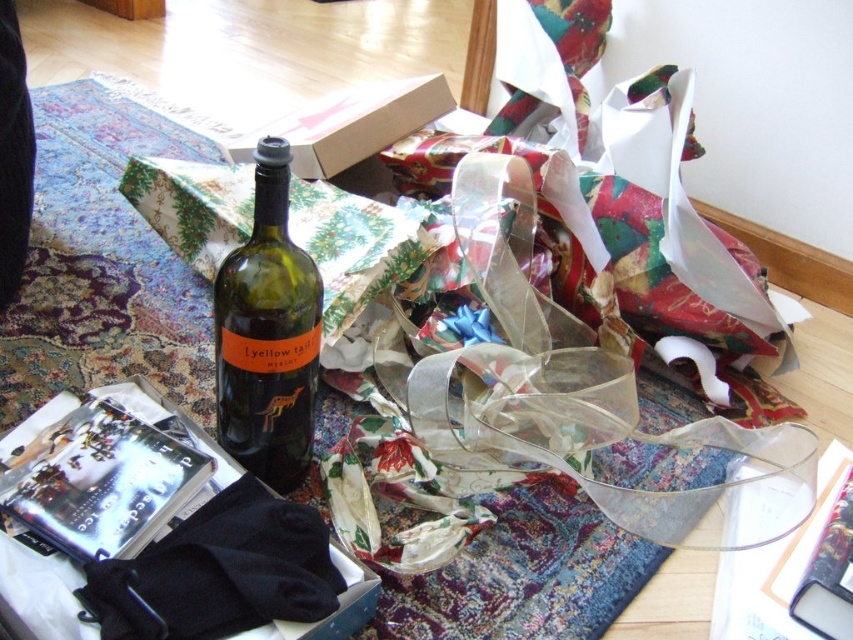
Question: Can you confirm if green glass bottle at center is bigger than matte cardboard box at center?

Choices:
 (A) yes
 (B) no

Answer: (B)

Question: Considering the relative positions of green glass bottle at center and matte cardboard box at center in the image provided, where is green glass bottle at center located with respect to matte cardboard box at center?

Choices:
 (A) left
 (B) right

Answer: (B)

Question: Does green glass bottle at center appear over matte cardboard box at center?

Choices:
 (A) no
 (B) yes

Answer: (A)